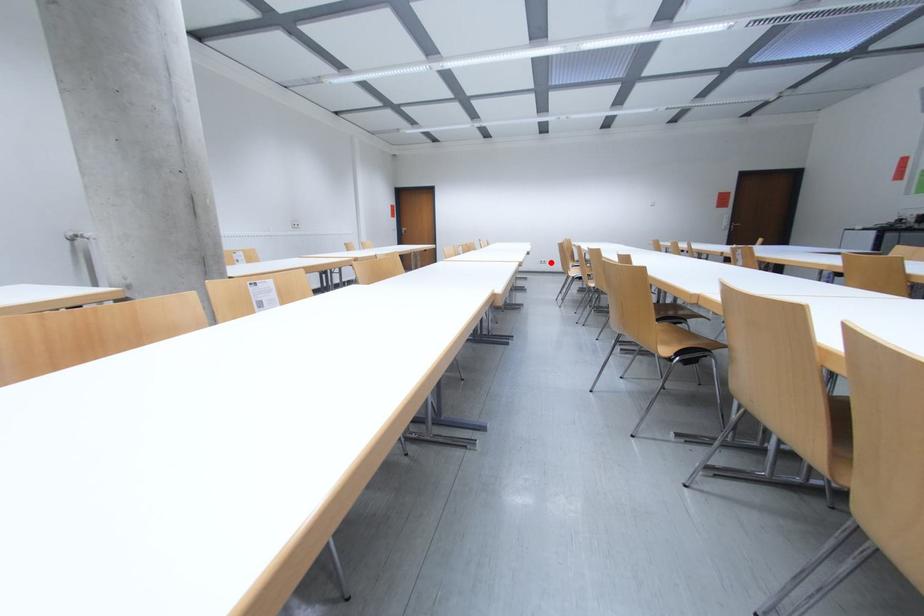
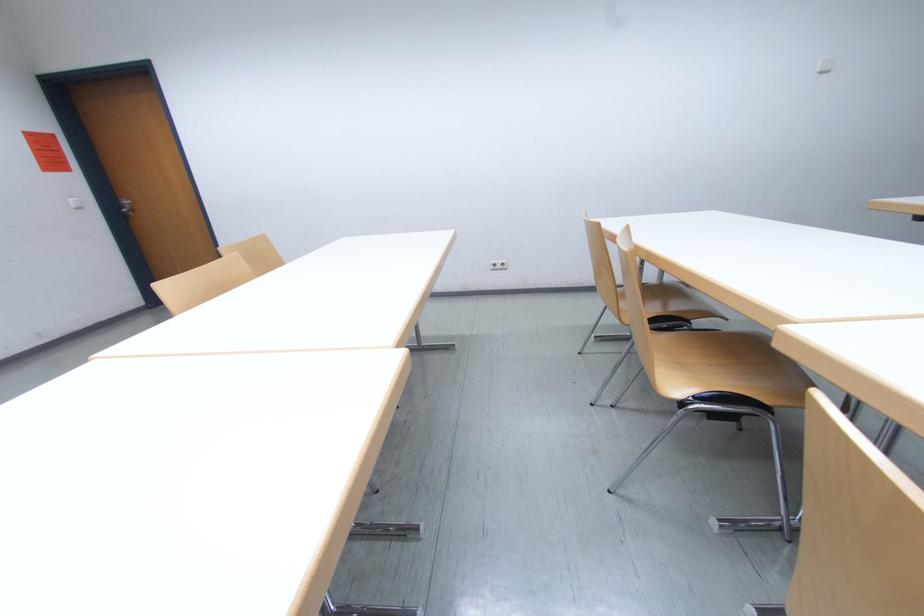
Locate, in the second image, the point that corresponds to the highlighted location in the first image.

(505, 265)